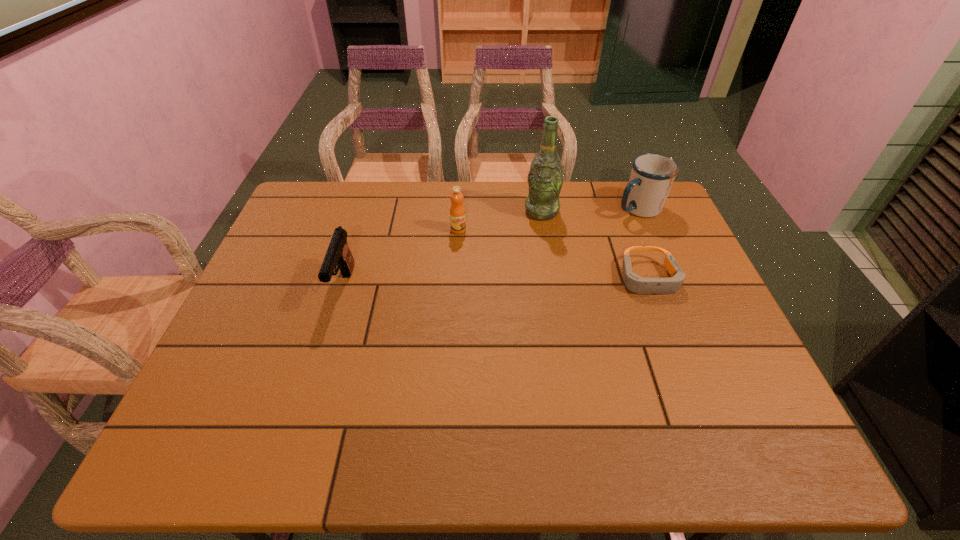
Locate an element on the screen. This screenshot has width=960, height=540. the second closest object to the mug is located at coordinates (545, 179).

Identify which object is located as the third nearest to the third farthest object. Please provide its 2D coordinates. Your answer should be formatted as a tuple, i.e. [(x, y)], where the tuple contains the x and y coordinates of a point satisfying the conditions above.

[(633, 282)]